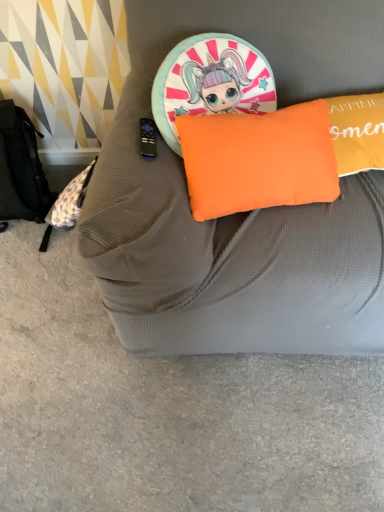
Question: In the image, is orange fabric cushion at upper center positioned in front of or behind orange fabric pillow at center?

Choices:
 (A) behind
 (B) front

Answer: (B)

Question: From their relative heights in the image, would you say orange fabric cushion at upper center is taller or shorter than orange fabric pillow at center?

Choices:
 (A) tall
 (B) short

Answer: (A)

Question: Looking at their shapes, would you say orange fabric cushion at upper center is wider or thinner than orange fabric pillow at center?

Choices:
 (A) thin
 (B) wide

Answer: (B)

Question: Looking at their shapes, would you say orange fabric pillow at center is wider or thinner than orange fabric cushion at upper center?

Choices:
 (A) thin
 (B) wide

Answer: (A)

Question: Is orange fabric pillow at center in front of or behind orange fabric cushion at upper center in the image?

Choices:
 (A) front
 (B) behind

Answer: (B)

Question: From the image's perspective, is orange fabric pillow at center located above or below orange fabric cushion at upper center?

Choices:
 (A) below
 (B) above

Answer: (A)

Question: From a real-world perspective, is orange fabric pillow at center above or below orange fabric cushion at upper center?

Choices:
 (A) below
 (B) above

Answer: (B)